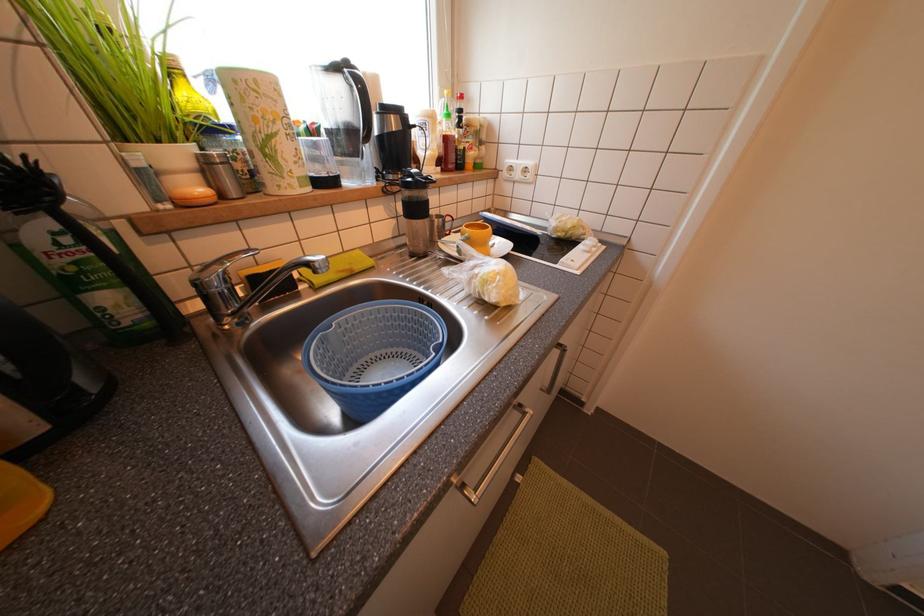
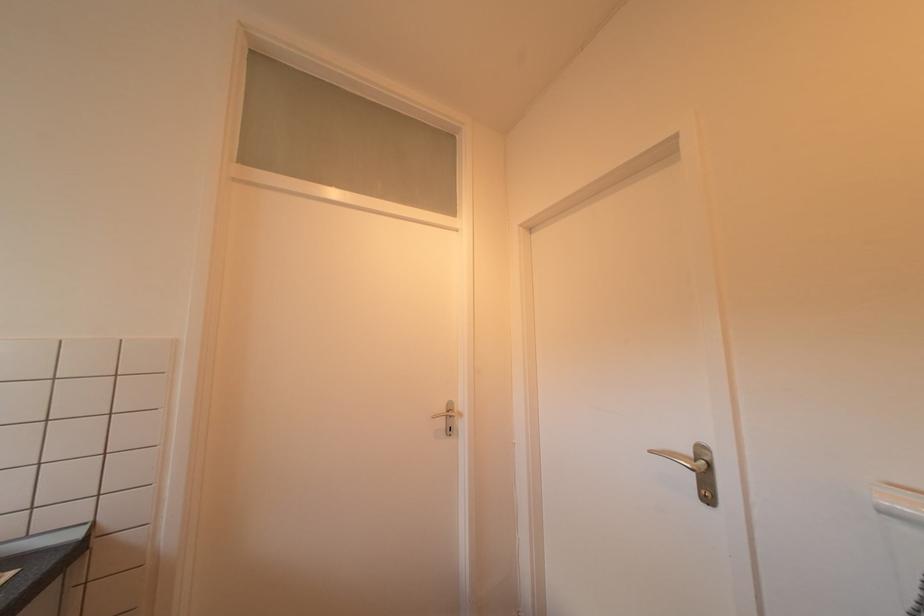
Looking at this image, the first image is from the beginning of the video and the second image is from the end. How did the camera likely rotate when shooting the video?

The camera's rotation is toward right-up.